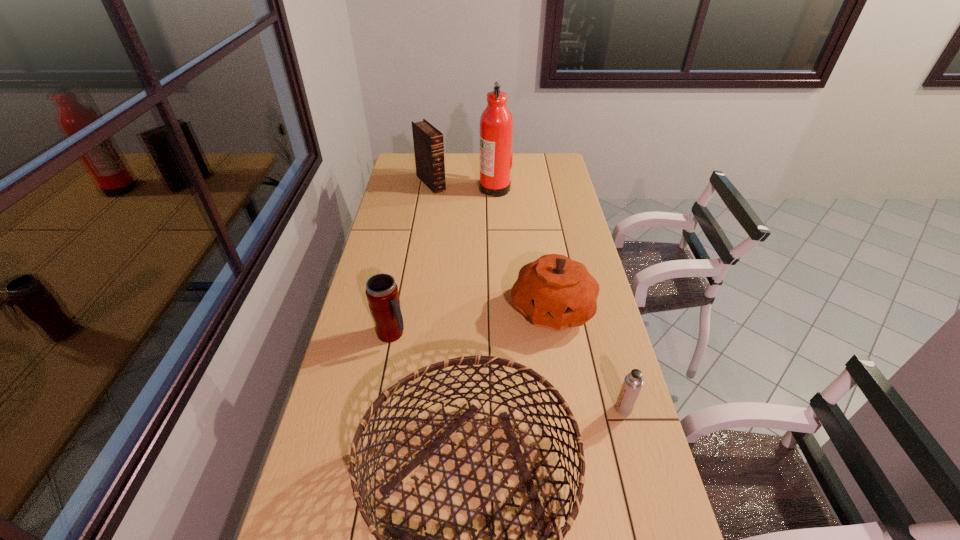
You are a GUI agent. You are given a task and a screenshot of the screen. Output one action in this format:
    pyautogui.click(x=<x>, y=<y>)
    Task: Click on the tallest object
    This screenshot has width=960, height=540.
    Given the screenshot: What is the action you would take?
    pyautogui.click(x=496, y=123)

At what (x,y) coordinates should I click in order to perform the action: click on the fifth shortest object. Please return your answer as a coordinate pair (x, y). The height and width of the screenshot is (540, 960). Looking at the image, I should click on (428, 141).

Identify the location of pumpkin. (555, 292).

Locate an element on the screen. the farther thermos bottle is located at coordinates (382, 294).

This screenshot has width=960, height=540. What are the coordinates of `the left thermos bottle` in the screenshot? It's located at (382, 294).

The height and width of the screenshot is (540, 960). What are the coordinates of `the shortest object` in the screenshot? It's located at (633, 382).

I want to click on the shorter thermos bottle, so click(633, 382).

The height and width of the screenshot is (540, 960). Find the location of `free point located on the label side of the fire extinguisher`. free point located on the label side of the fire extinguisher is located at coordinates (398, 188).

Find the location of `vacant space located 0.140m on the label side of the fire extinguisher`. vacant space located 0.140m on the label side of the fire extinguisher is located at coordinates (450, 188).

You are a GUI agent. You are given a task and a screenshot of the screen. Output one action in this format:
    pyautogui.click(x=<x>, y=<y>)
    Task: Click on the vacant space located 0.200m on the label side of the fire extinguisher
    
    Given the screenshot: What is the action you would take?
    pyautogui.click(x=438, y=188)